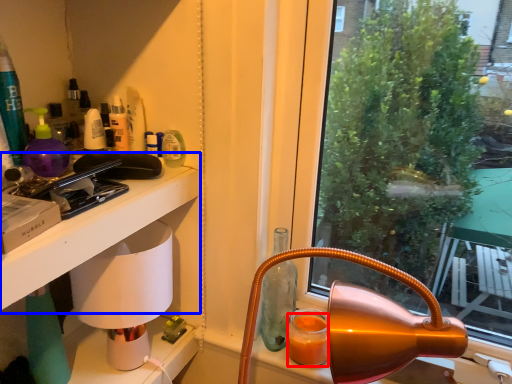
Question: Which object appears closest to the camera in this image, orange juice (highlighted by a red box) or table (highlighted by a blue box)?

Choices:
 (A) orange juice
 (B) table

Answer: (B)